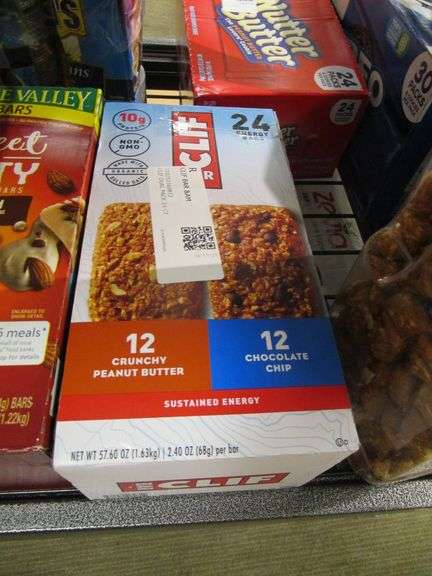
Identify the location of floor. Image resolution: width=432 pixels, height=576 pixels. (254, 543).